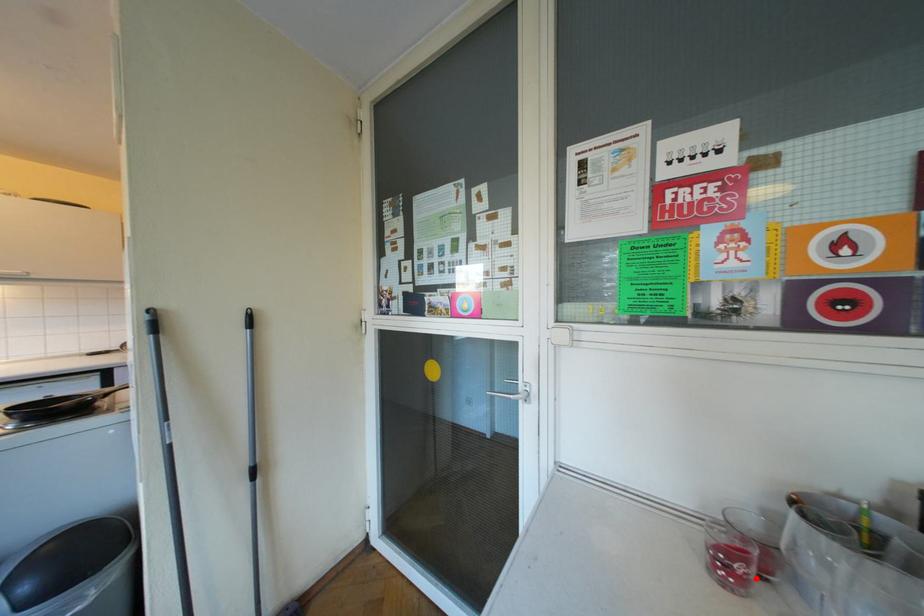
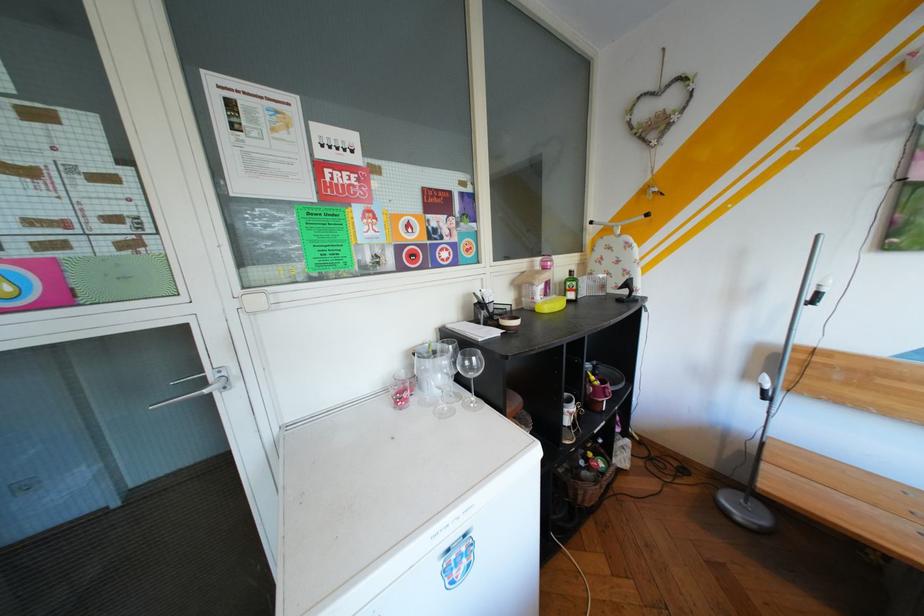
Locate, in the second image, the point that corresponds to the highlighted location in the first image.

(419, 399)